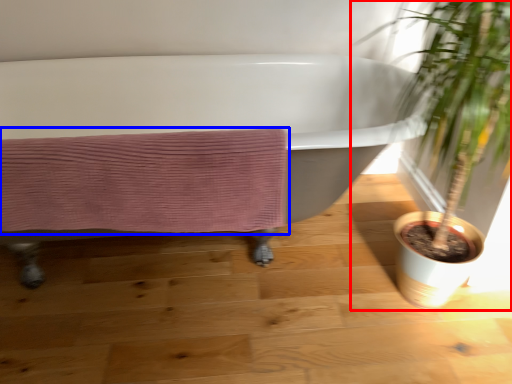
Question: Which of the following is the farthest to the observer, houseplant (highlighted by a red box) or bath towel (highlighted by a blue box)?

Choices:
 (A) houseplant
 (B) bath towel

Answer: (B)